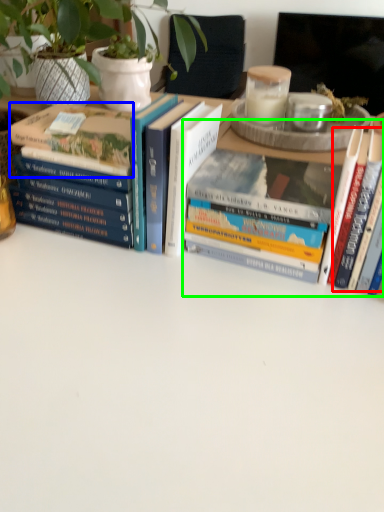
Question: Which object is positioned closest to book (highlighted by a red box)? Select from book (highlighted by a blue box) and book (highlighted by a green box).

Choices:
 (A) book
 (B) book

Answer: (B)